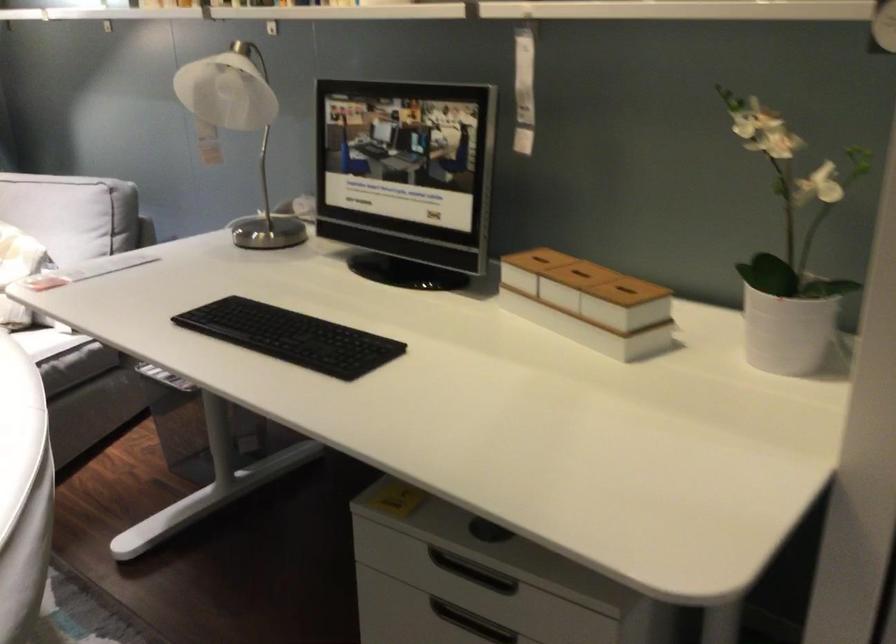
You are a GUI agent. You are given a task and a screenshot of the screen. Output one action in this format:
    pyautogui.click(x=<x>, y=<y>)
    Task: Click on the sofa armrest
    The image size is (896, 644).
    Given the screenshot: What is the action you would take?
    pyautogui.click(x=22, y=489)